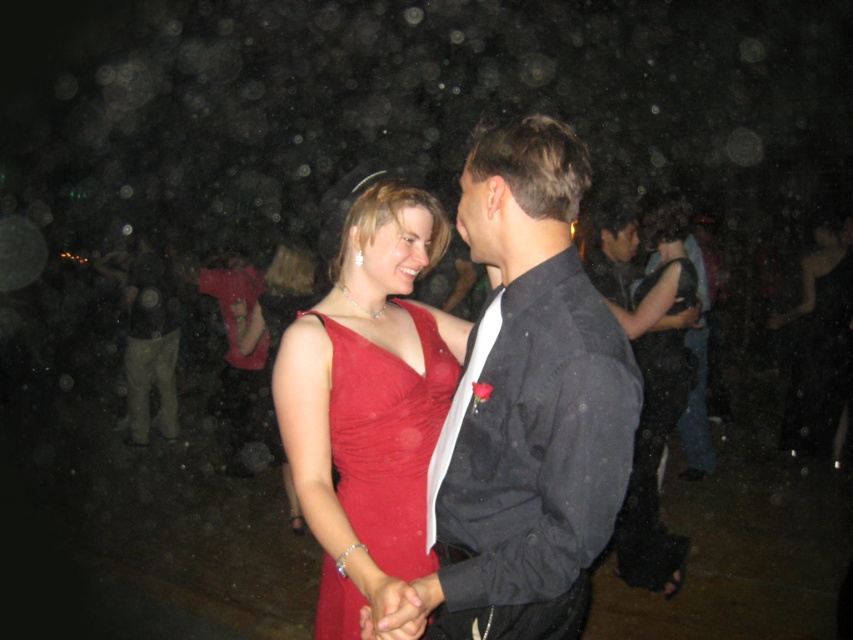
Can you confirm if black satin dress at center is bigger than shiny red dress at center?

Correct, black satin dress at center is larger in size than shiny red dress at center.

Does black satin dress at center appear on the right side of shiny red dress at center?

Indeed, black satin dress at center is positioned on the right side of shiny red dress at center.

Describe the element at coordinates (651, 381) in the screenshot. I see `black satin dress at center` at that location.

At what (x,y) coordinates should I click in order to perform the action: click on black satin dress at center. Please return your answer as a coordinate pair (x, y). Looking at the image, I should click on (651, 381).

Is black satin dress at center bigger than matte red dress at center?

No.

Is the position of black satin dress at center less distant than that of matte red dress at center?

Yes, black satin dress at center is closer to the viewer.

Which is in front, point (654, 330) or point (817, 419)?

Point (654, 330) is in front.

At what (x,y) coordinates should I click in order to perform the action: click on black satin dress at center. Please return your answer as a coordinate pair (x, y). Looking at the image, I should click on (651, 381).

The width and height of the screenshot is (853, 640). What do you see at coordinates (526, 408) in the screenshot?
I see `shiny black suit at center` at bounding box center [526, 408].

Where is `shiny black suit at center`? This screenshot has width=853, height=640. shiny black suit at center is located at coordinates (526, 408).

Locate an element on the screen. Image resolution: width=853 pixels, height=640 pixels. shiny black suit at center is located at coordinates (526, 408).